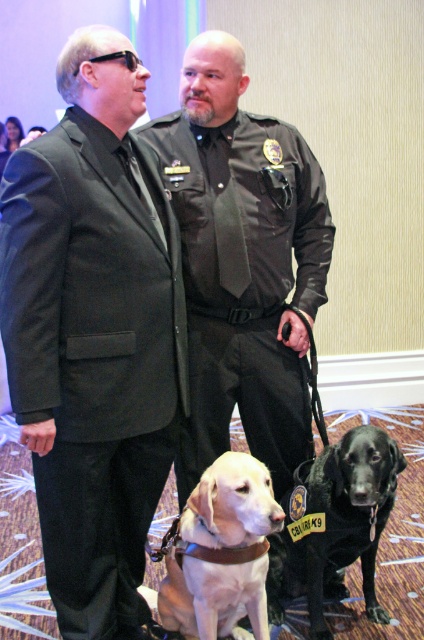
Question: Is the position of light brown fur at center more distant than that of black matte dog at center?

Choices:
 (A) no
 (B) yes

Answer: (A)

Question: Which point is farther to the camera?

Choices:
 (A) (220, 212)
 (B) (103, 300)
 (C) (304, 499)
 (D) (248, 596)

Answer: (C)

Question: Which object is the farthest from the black matte dog at center?

Choices:
 (A) black leather uniform at center
 (B) black smooth suit at left
 (C) light brown fur at center

Answer: (B)

Question: Does black smooth suit at left appear on the right side of black matte dog at center?

Choices:
 (A) yes
 (B) no

Answer: (B)

Question: Which point is farther to the camera?

Choices:
 (A) black leather uniform at center
 (B) black matte dog at center

Answer: (A)

Question: From the image, what is the correct spatial relationship of black leather uniform at center in relation to light brown fur at center?

Choices:
 (A) above
 (B) below

Answer: (A)